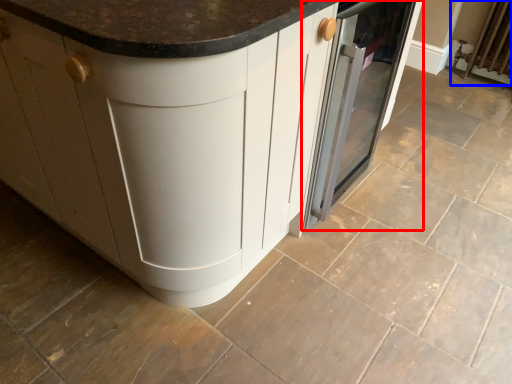
Question: Which object appears farthest to the camera in this image, home appliance (highlighted by a red box) or radiator (highlighted by a blue box)?

Choices:
 (A) home appliance
 (B) radiator

Answer: (B)